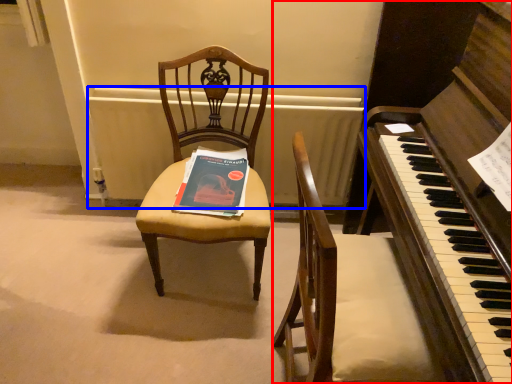
Question: Which point is further to the camera, harpsichord (highlighted by a red box) or radiator (highlighted by a blue box)?

Choices:
 (A) harpsichord
 (B) radiator

Answer: (B)